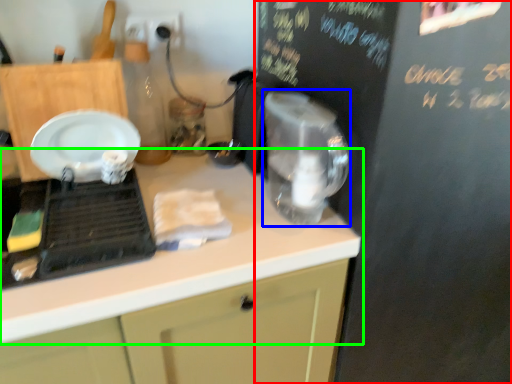
Question: Which is nearer to the bulletin board (highlighted by a red box)? appliance (highlighted by a blue box) or countertop (highlighted by a green box).

Choices:
 (A) appliance
 (B) countertop

Answer: (A)